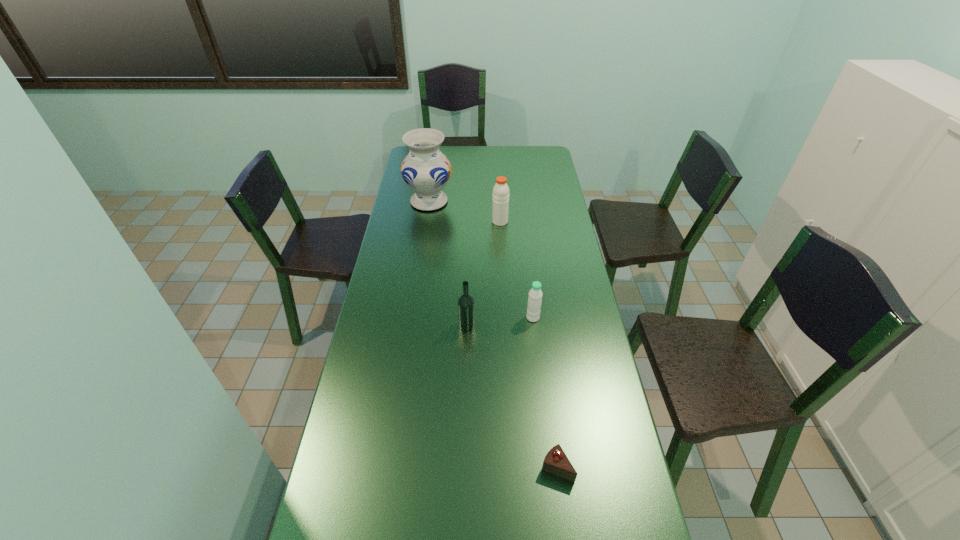
Locate an element on the screen. The height and width of the screenshot is (540, 960). vacant area situated on the right of the second object from left to right is located at coordinates (586, 325).

Locate an element on the screen. free point located 0.330m on the left of the second shortest object is located at coordinates (429, 318).

Where is `vacant space located 0.060m on the back of the chocolate cake`? This screenshot has height=540, width=960. vacant space located 0.060m on the back of the chocolate cake is located at coordinates (552, 431).

Where is `object at the left edge`? The height and width of the screenshot is (540, 960). object at the left edge is located at coordinates (426, 170).

The width and height of the screenshot is (960, 540). Identify the location of object at the right edge. (556, 462).

Where is `vacant area at the far edge of the desktop`? This screenshot has width=960, height=540. vacant area at the far edge of the desktop is located at coordinates (505, 157).

I want to click on vacant position at the left edge of the desktop, so click(x=371, y=415).

Image resolution: width=960 pixels, height=540 pixels. I want to click on blank space at the right edge, so click(539, 186).

Locate an element on the screen. vacant space at the far right corner of the desktop is located at coordinates (537, 146).

Where is `free space between the second shortest object and the vodka`? free space between the second shortest object and the vodka is located at coordinates (500, 321).